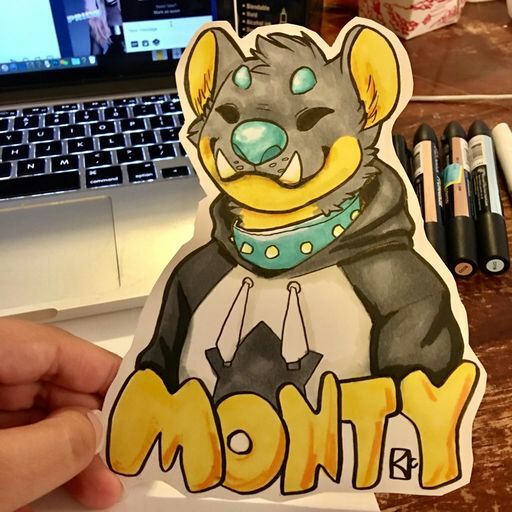
Locate an element on the screen. keyboard is located at coordinates (68, 130).